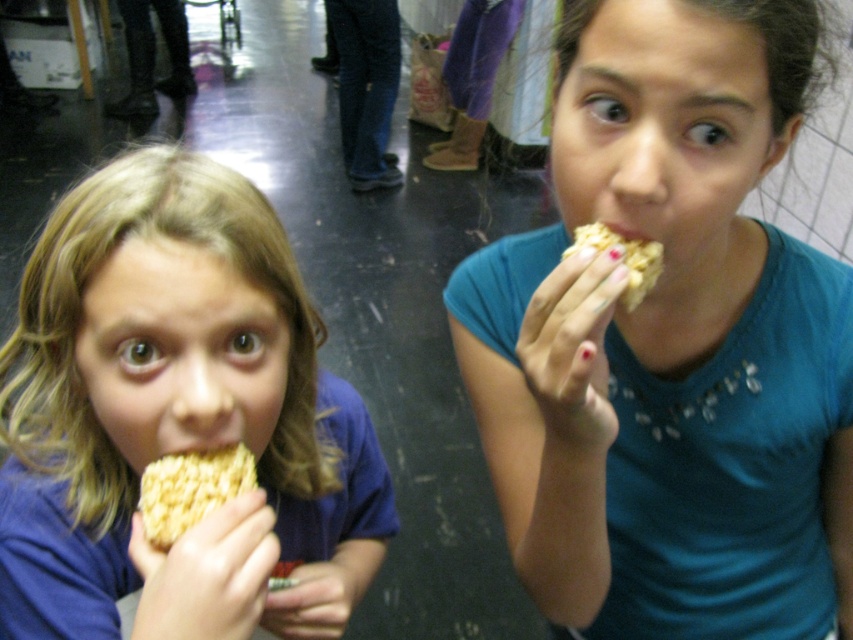
Question: Does matte yellow rice krispie treat at left come in front of yellow crumbly snack at lower left?

Choices:
 (A) yes
 (B) no

Answer: (A)

Question: Estimate the real-world distances between objects in this image. Which object is closer to the yellow crumbly snack at upper right?

Choices:
 (A) matte yellow rice krispie treat at left
 (B) matte yellow rice krispie treat at center
 (C) yellow crumbly snack at lower left

Answer: (B)

Question: Which of the following is the farthest from the observer?

Choices:
 (A) (641, 298)
 (B) (178, 515)
 (C) (677, 120)
 (D) (175, 218)

Answer: (A)

Question: Which point is farther from the camera taking this photo?

Choices:
 (A) click(163, 548)
 (B) click(50, 538)

Answer: (B)

Question: Can you confirm if matte yellow rice krispie treat at left is thinner than yellow crumbly snack at upper right?

Choices:
 (A) no
 (B) yes

Answer: (A)

Question: Does matte yellow rice krispie treat at center have a smaller size compared to matte yellow rice krispie treat at left?

Choices:
 (A) no
 (B) yes

Answer: (A)